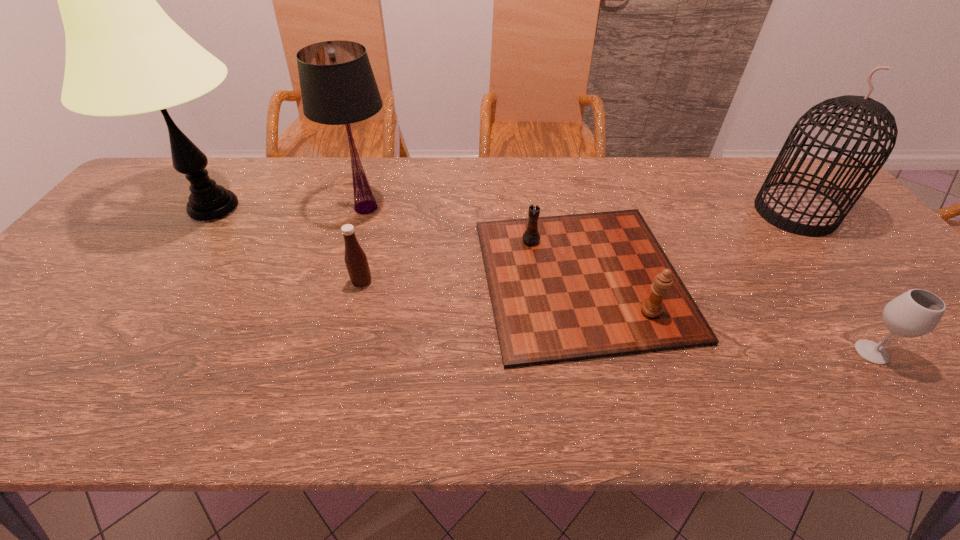
Where is `vacant point located between the Tabasco sauce and the fourth object from left to right`? The height and width of the screenshot is (540, 960). vacant point located between the Tabasco sauce and the fourth object from left to right is located at coordinates (471, 280).

The width and height of the screenshot is (960, 540). Identify the location of empty space that is in between the lampshade and the gameboard. (473, 243).

At what (x,y) coordinates should I click in order to perform the action: click on unoccupied position between the leftmost object and the birdcage. Please return your answer as a coordinate pair (x, y). Looking at the image, I should click on (505, 211).

The image size is (960, 540). Identify the location of vacant area that lies between the lamp and the gameboard. (397, 243).

Identify the location of the third closest object to the Tabasco sauce. (124, 55).

Identify which object is located as the fourth nearest to the lampshade. Please provide its 2D coordinates. Your answer should be formatted as a tuple, i.e. [(x, y)], where the tuple contains the x and y coordinates of a point satisfying the conditions above.

[(799, 209)]

This screenshot has width=960, height=540. In order to click on free region that satisfies the following two spatial constraints: 1. on the front-facing side of the wineglass; 2. on the left side of the lampshade in this screenshot , I will do `click(324, 352)`.

Where is `free space that satisfies the following two spatial constraints: 1. on the front-facing side of the lampshade; 2. on the back side of the wineglass`? free space that satisfies the following two spatial constraints: 1. on the front-facing side of the lampshade; 2. on the back side of the wineglass is located at coordinates (324, 352).